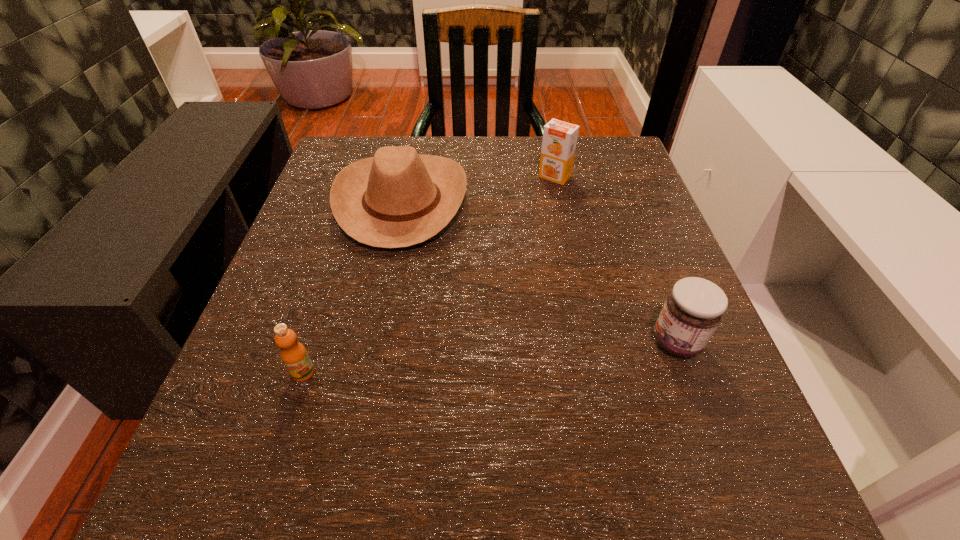
Identify the location of the farther orange juice. Image resolution: width=960 pixels, height=540 pixels. (559, 141).

Locate an element on the screen. the right orange juice is located at coordinates click(x=559, y=141).

Where is `cowboy hat`? cowboy hat is located at coordinates (398, 198).

Identify the location of jam. (694, 308).

Locate an element on the screen. the nearer orange juice is located at coordinates (293, 354).

Image resolution: width=960 pixels, height=540 pixels. What are the coordinates of `the left orange juice` in the screenshot? It's located at (293, 354).

The image size is (960, 540). Find the location of `free space located on the front of the farther orange juice`. free space located on the front of the farther orange juice is located at coordinates (563, 214).

This screenshot has width=960, height=540. In order to click on free space located on the front-facing side of the cowboy hat in this screenshot , I will do `click(645, 201)`.

Identify the location of free space located 0.250m on the front label of the rightmost object. The width and height of the screenshot is (960, 540). (487, 342).

Locate an element on the screen. vacant region located 0.230m on the front label of the rightmost object is located at coordinates (500, 342).